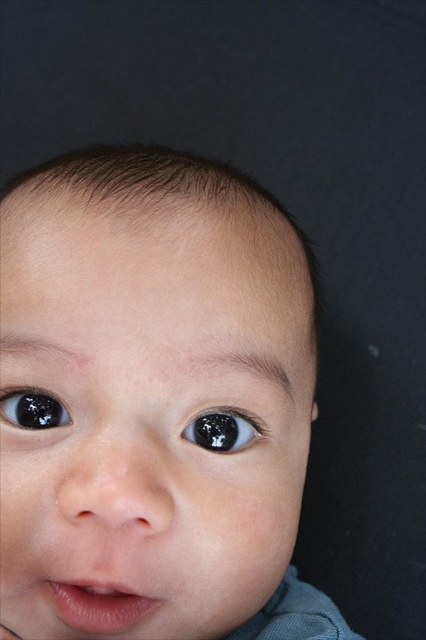
Question: Which of these objects is positioned farthest from the black glossy eye at left?

Choices:
 (A) black glossy eye at center
 (B) smooth skin baby at center

Answer: (B)

Question: Is black glossy eye at center above black glossy eye at left?

Choices:
 (A) no
 (B) yes

Answer: (A)

Question: Which object is positioned farthest from the black glossy eye at left?

Choices:
 (A) black glossy eye at center
 (B) smooth skin baby at center

Answer: (B)

Question: Is black glossy eye at center behind black glossy eye at left?

Choices:
 (A) no
 (B) yes

Answer: (A)

Question: Estimate the real-world distances between objects in this image. Which object is closer to the black glossy eye at left?

Choices:
 (A) smooth skin baby at center
 (B) black glossy eye at center

Answer: (B)

Question: Is black glossy eye at center to the right of black glossy eye at left from the viewer's perspective?

Choices:
 (A) yes
 (B) no

Answer: (A)